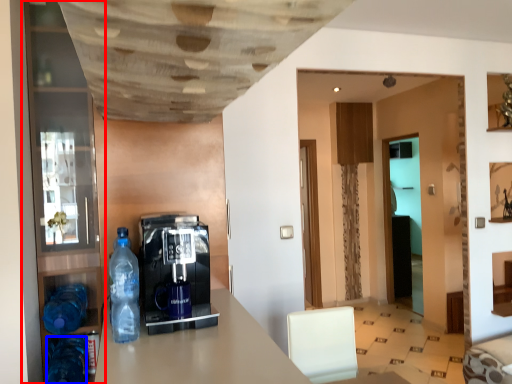
Question: Which object appears farthest to the camera in this image, pantry (highlighted by a red box) or bottle (highlighted by a blue box)?

Choices:
 (A) pantry
 (B) bottle

Answer: (A)